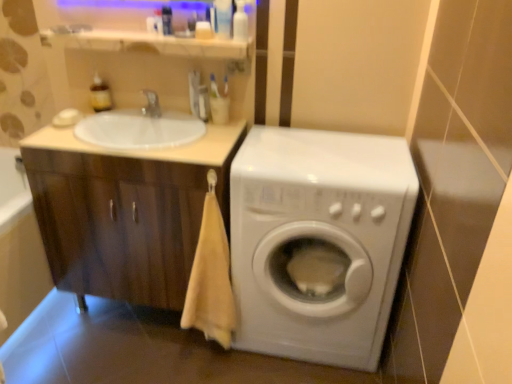
Image resolution: width=512 pixels, height=384 pixels. What are the coordinates of `vacant area in front of translucent plastic toothbrush at upper center, which appears as the third toiletry when viewed from the left` in the screenshot? It's located at (201, 135).